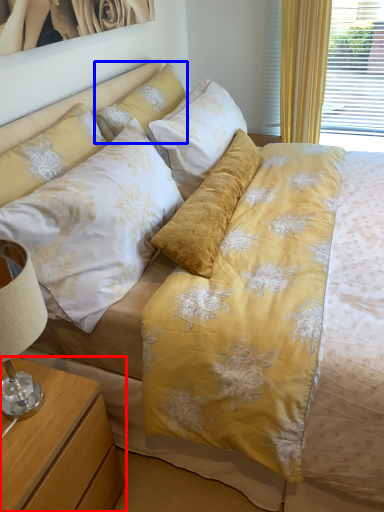
Question: Among these objects, which one is farthest to the camera, nightstand (highlighted by a red box) or pillow (highlighted by a blue box)?

Choices:
 (A) nightstand
 (B) pillow

Answer: (B)